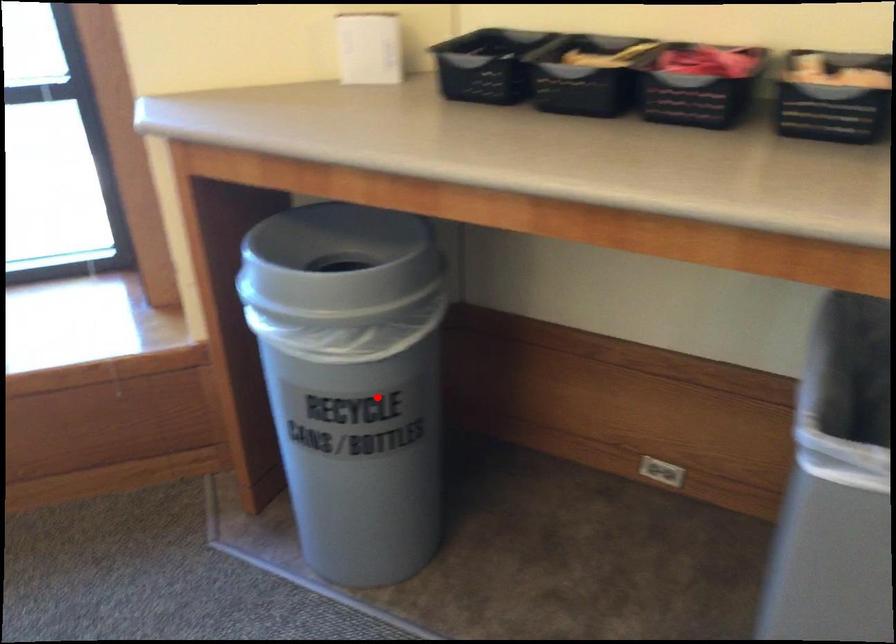
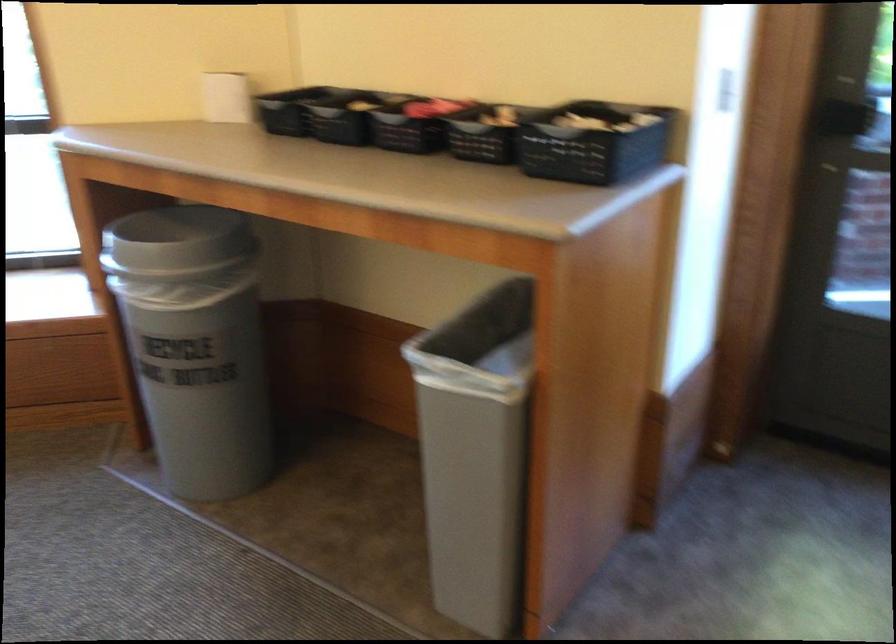
Question: A red point is marked in image1. In image2, is the corresponding 3D point closer to the camera or farther? Reply with the corresponding letter.

Choices:
 (A) The corresponding 3D point is closer.
 (B) The corresponding 3D point is farther.

Answer: (B)